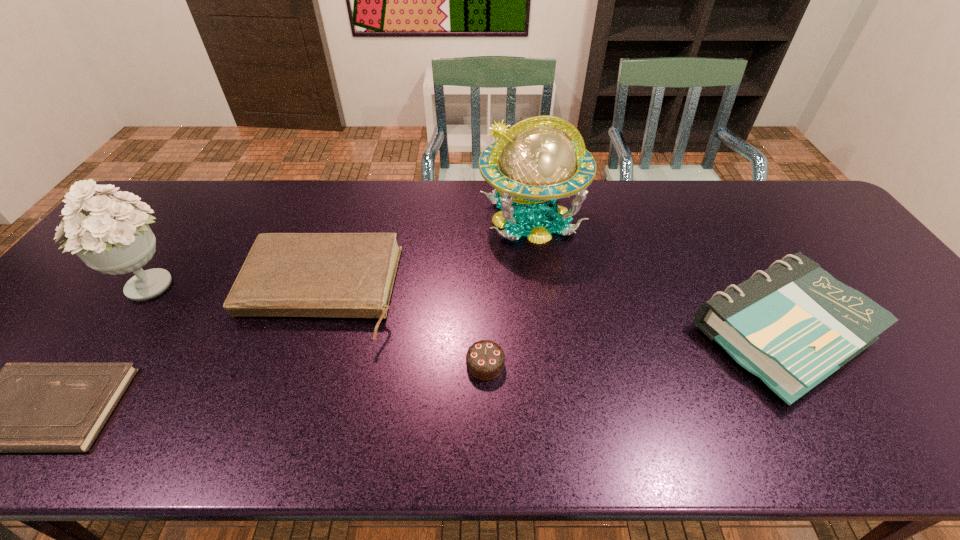
This screenshot has height=540, width=960. Identify the location of vacant space situated on the spine side of the second paperback book from right to left. [x=274, y=432].

You are a GUI agent. You are given a task and a screenshot of the screen. Output one action in this format:
    pyautogui.click(x=<x>, y=<y>)
    Task: Click on the free space located 0.340m on the left of the chocolate cake
    The image size is (960, 540).
    Given the screenshot: What is the action you would take?
    pyautogui.click(x=319, y=364)

This screenshot has width=960, height=540. I want to click on object positioned at the far edge, so click(x=538, y=164).

You are a GUI agent. You are given a task and a screenshot of the screen. Output one action in this format:
    pyautogui.click(x=<x>, y=<y>)
    Task: Click on the object that is at the left edge
    This screenshot has width=960, height=540.
    Given the screenshot: What is the action you would take?
    pyautogui.click(x=115, y=238)

The width and height of the screenshot is (960, 540). What are the coordinates of `object present at the right edge` in the screenshot? It's located at (792, 325).

In the image, there is a desktop. At what (x,y) coordinates should I click in order to perform the action: click on vacant space at the far edge. Please return your answer as a coordinate pair (x, y). This screenshot has height=540, width=960. Looking at the image, I should click on (638, 191).

I want to click on vacant space at the near edge, so click(x=720, y=416).

Where is `free space at the left edge`? This screenshot has height=540, width=960. free space at the left edge is located at coordinates (59, 313).

Locate an element on the screen. The image size is (960, 540). vacant space at the far right corner of the desktop is located at coordinates (799, 192).

Identify the location of free spot between the bouquet and the chocolate cake. (318, 324).